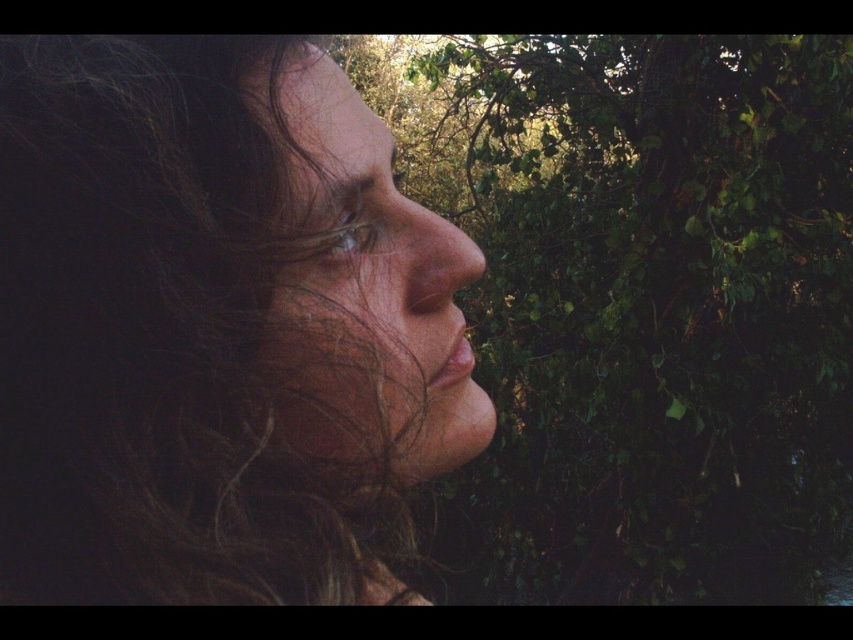
You are a photographer trying to capture a portrait of the person in the scene. The subject has dark curly hair at left and there is a green leafy tree at right in the background. To ensure the hair is visible against the background, which object should you adjust the focus on and why?

The dark curly hair at left is below the green leafy tree at right. To ensure the hair is visible, focus on the dark curly hair at left because it is closer to the camera than the tree, allowing for better contrast against the background.

You are a photographer trying to capture the smooth skin face at center without any obstructions. Is the green leafy tree at right blocking the face?

The green leafy tree at right is above the smooth skin face at center, so it is not blocking the face since it is positioned higher up.

You are a photographer trying to capture the person in the scene. Since you want to focus on their face, do you need to adjust your camera to avoid the dark curly hair at left overlapping with the green leafy tree at right?

The dark curly hair at left is in front of the green leafy tree at right, so it is already overlapping. To avoid this overlap and focus on the face, you should adjust the camera angle or position to move the dark curly hair at left out of the frame or ensure the green leafy tree at right is not in the background of the face.